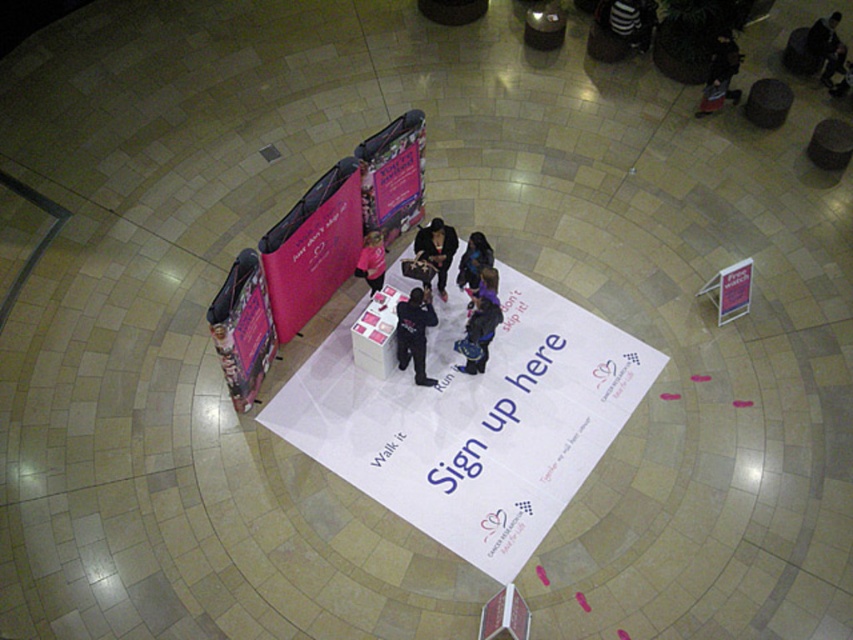
Question: Based on their relative distances, which object is farther from the black matte jacket at center?

Choices:
 (A) blue fabric jacket at center
 (B) black leather jacket at center
 (C) dark blue fabric jacket at center
 (D) pink matte shirt at center

Answer: (A)

Question: Is blue fabric jacket at center positioned behind pink matte shirt at center?

Choices:
 (A) no
 (B) yes

Answer: (A)

Question: Which object is positioned farthest from the pink matte shirt at center?

Choices:
 (A) blue fabric jacket at center
 (B) matte black shirt at center
 (C) black matte jacket at center

Answer: (B)

Question: Does blue fabric jacket at center appear on the left side of pink matte shirt at center?

Choices:
 (A) yes
 (B) no

Answer: (B)

Question: Is dark blue fabric jacket at center below matte black shirt at center?

Choices:
 (A) no
 (B) yes

Answer: (B)

Question: Which point is closer to the camera?

Choices:
 (A) black leather jacket at center
 (B) black matte jacket at center
 (C) dark blue fabric jacket at center
 (D) blue fabric jacket at center

Answer: (B)